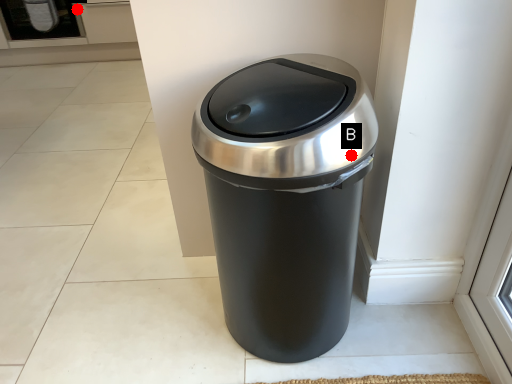
Question: Two points are circled on the image, labeled by A and B beside each circle. Among these points, which one is nearest to the camera?

Choices:
 (A) A is closer
 (B) B is closer

Answer: (B)